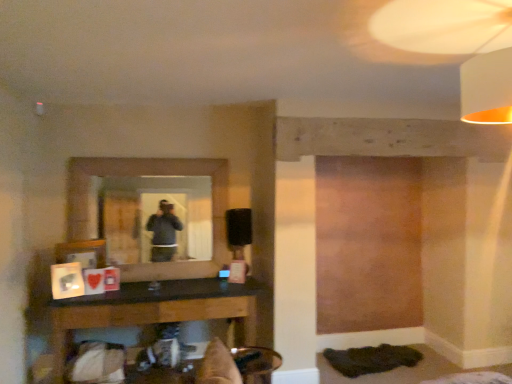
Question: From the image's perspective, is white fabric lampshade at upper right located above or below matte glass mirror at center?

Choices:
 (A) below
 (B) above

Answer: (B)

Question: In terms of height, does white fabric lampshade at upper right look taller or shorter compared to matte glass mirror at center?

Choices:
 (A) short
 (B) tall

Answer: (A)

Question: Based on their relative distances, which object is farther from the matte glass mirror at center?

Choices:
 (A) white fabric lampshade at upper right
 (B) black matte table lamp at center
 (C) black wood table at lower center
 (D) metallic gold swivel chair at lower center

Answer: (A)

Question: Based on their relative distances, which object is nearer to the white fabric lampshade at upper right?

Choices:
 (A) black wood table at lower center
 (B) metallic gold swivel chair at lower center
 (C) matte glass mirror at center
 (D) black matte table lamp at center

Answer: (B)